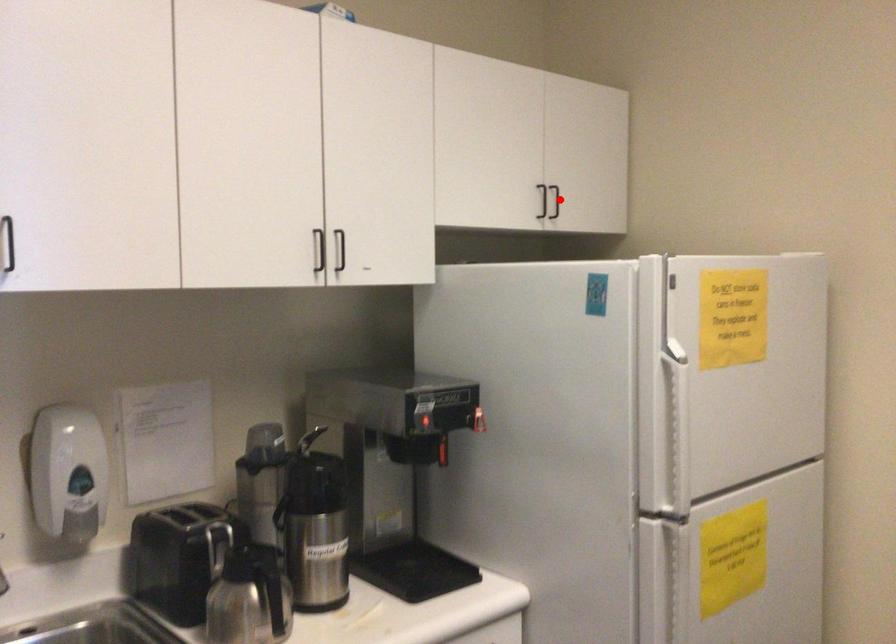
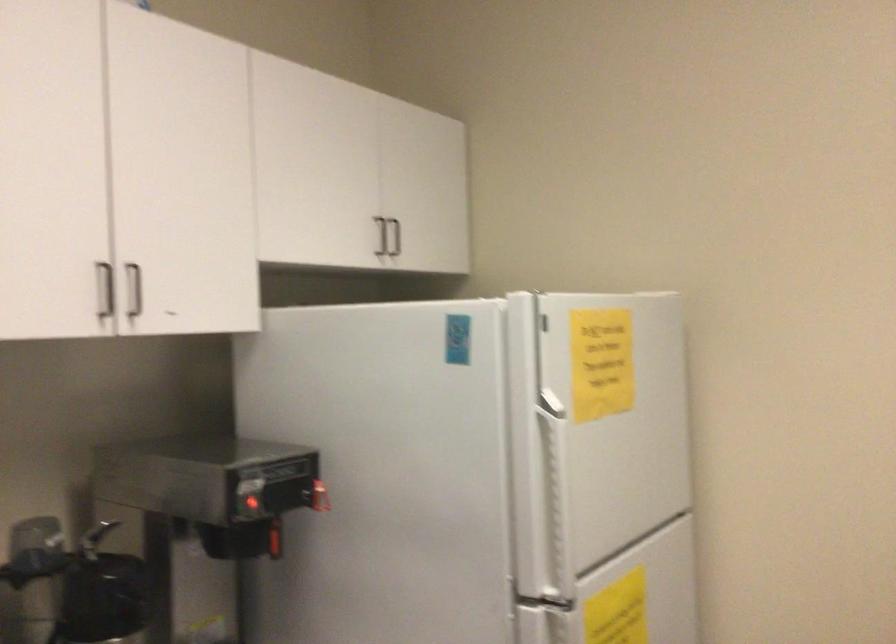
The point at the highlighted location is marked in the first image. Where is the corresponding point in the second image?

(394, 237)